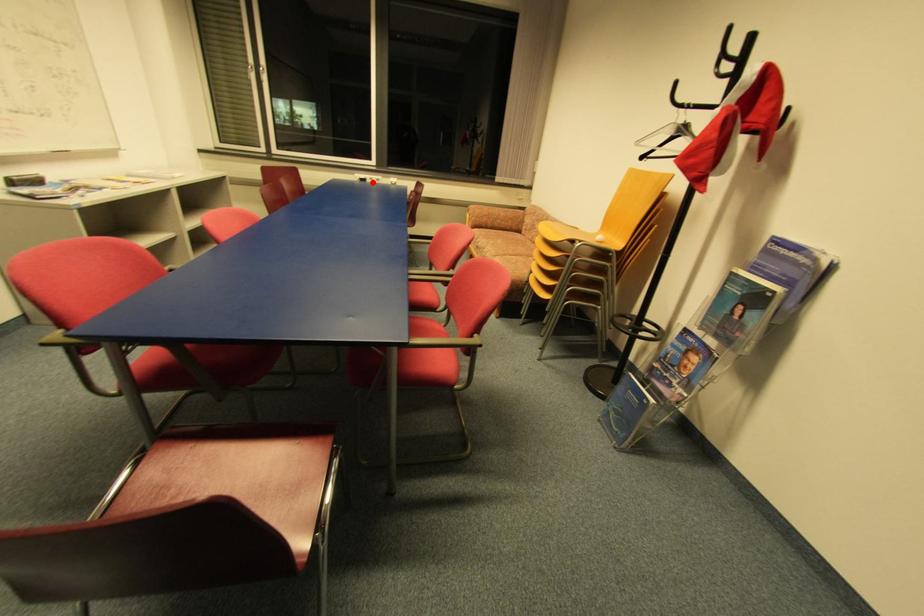
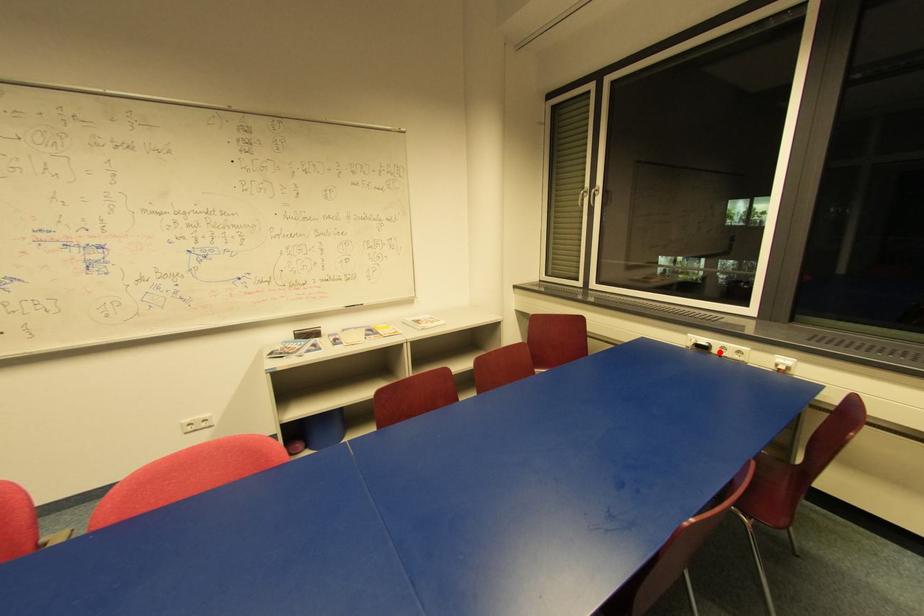
I am providing you with two images of the same scene from different viewpoints. A red point is marked on the first image and another point is marked on the second image. Does the point marked in image1 correspond to the same location as the one in image2?

Yes